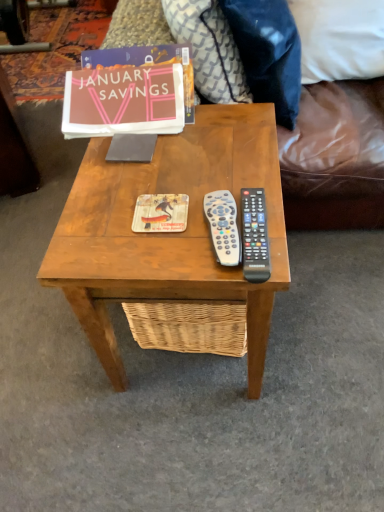
This screenshot has height=512, width=384. I want to click on vacant space situated on the left part of matte paper book cover at center, so click(x=97, y=220).